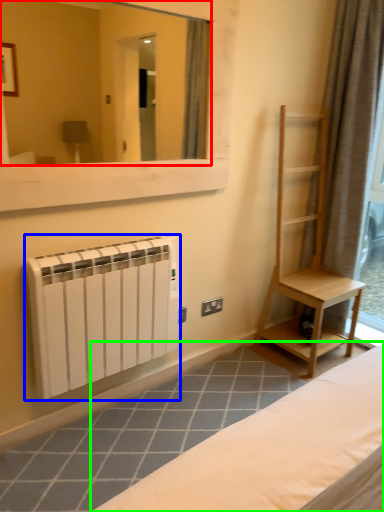
Question: Which object is the farthest from mirror (highlighted by a red box)? Choose among these: radiator (highlighted by a blue box) or furniture (highlighted by a green box).

Choices:
 (A) radiator
 (B) furniture

Answer: (B)